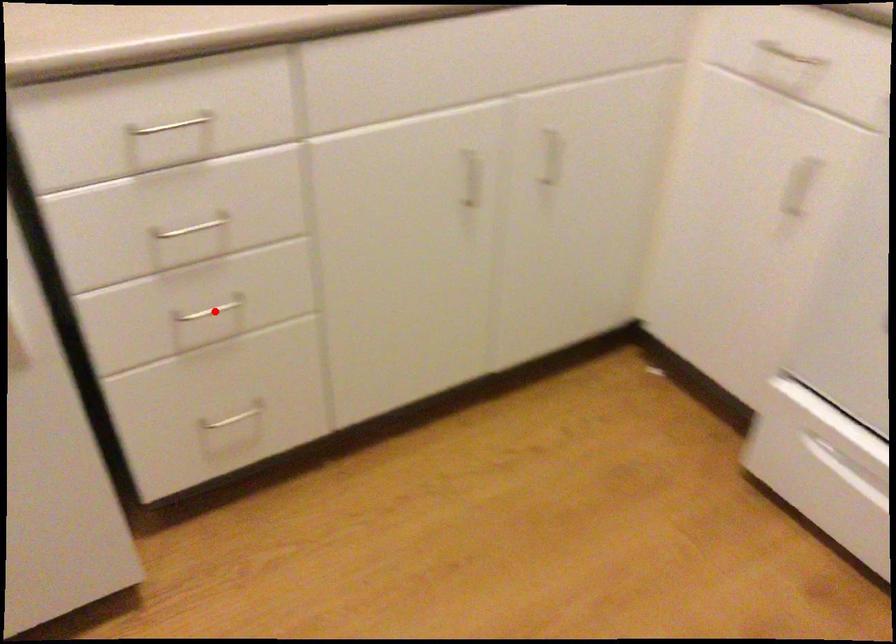
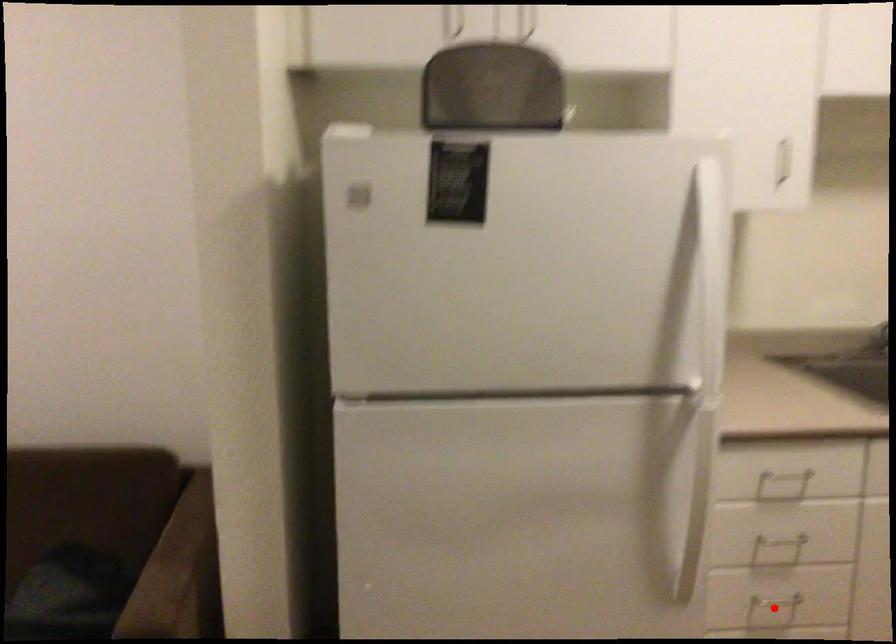
I am providing you with two images of the same scene from different viewpoints. A red point is marked on the first image and another point is marked on the second image. Are the points marked in image1 and image2 representing the same 3D position?

Yes